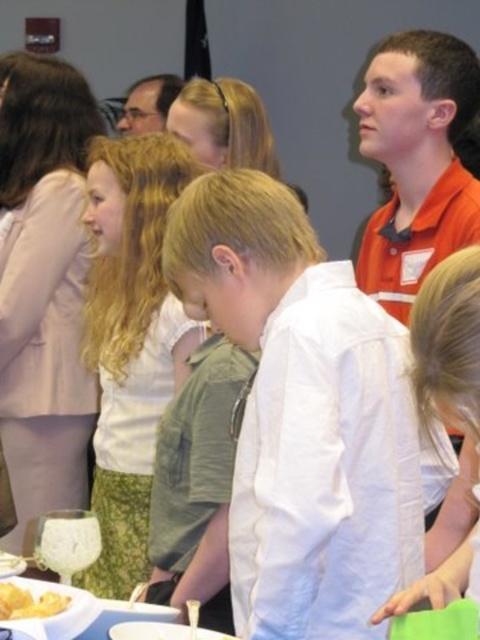
Question: Which object is the closest to the white matte plate at lower center?

Choices:
 (A) white cotton shirt at center
 (B) yellow matte bread at lower left

Answer: (B)

Question: Considering the relative positions of clear glass wine glass at lower left and white matte platter at lower left in the image provided, where is clear glass wine glass at lower left located with respect to white matte platter at lower left?

Choices:
 (A) above
 (B) below

Answer: (A)

Question: Does white smooth shirt at center have a larger size compared to white matte plate at lower center?

Choices:
 (A) no
 (B) yes

Answer: (B)

Question: Is white smooth shirt at center positioned before yellow matte bread at lower left?

Choices:
 (A) no
 (B) yes

Answer: (A)

Question: Which of the following is the closest to the observer?

Choices:
 (A) light brown hair at center
 (B) white matte plate at lower center

Answer: (B)

Question: Among these points, which one is farthest from the camera?

Choices:
 (A) [9, 576]
 (B) [457, 557]
 (C) [112, 198]

Answer: (C)